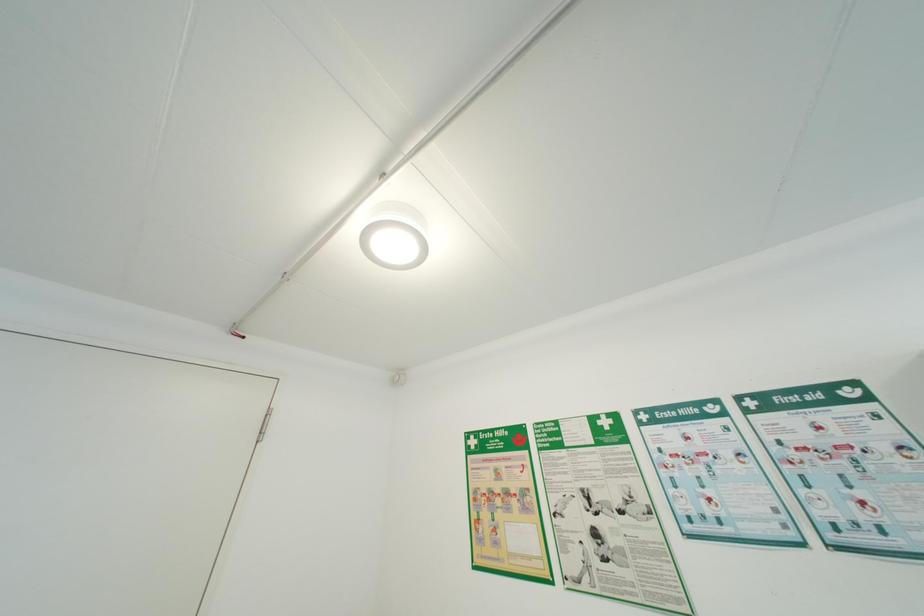
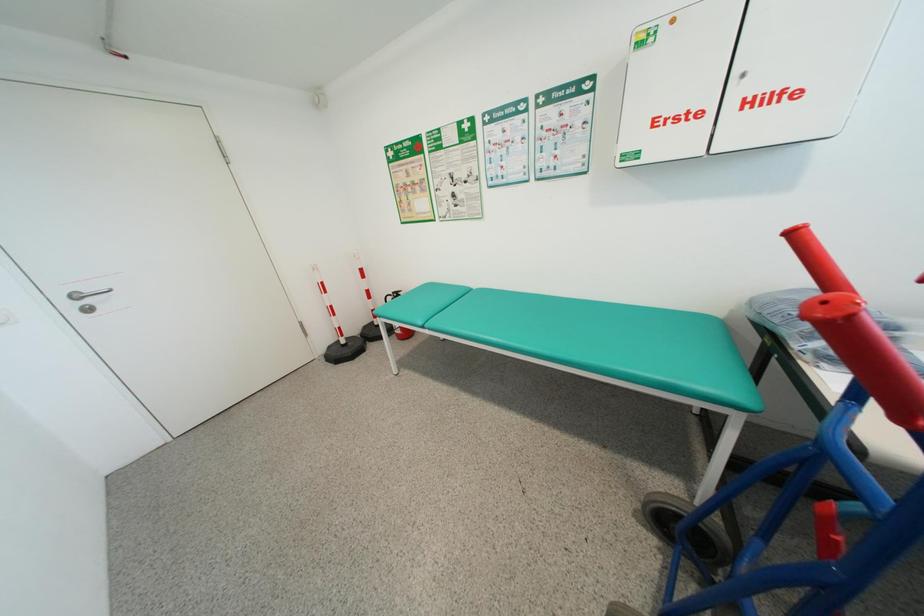
Question: The images are taken continuously from a first-person perspective. In which direction is your viewpoint rotating?

Choices:
 (A) Left
 (B) Right
 (C) Up
 (D) Down

Answer: (D)